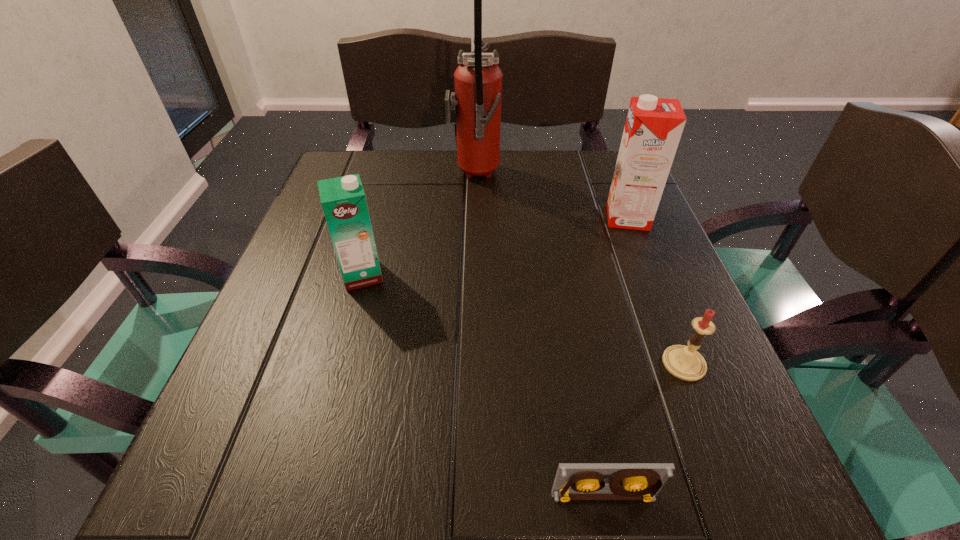
This screenshot has width=960, height=540. Find the location of `unoccupied area between the shortest object and the tallest object`. unoccupied area between the shortest object and the tallest object is located at coordinates (539, 336).

Find the location of `free space between the farthest object and the second tallest object`. free space between the farthest object and the second tallest object is located at coordinates (551, 197).

Where is `free spot between the third tallest object and the second farthest object`? The height and width of the screenshot is (540, 960). free spot between the third tallest object and the second farthest object is located at coordinates (494, 246).

Image resolution: width=960 pixels, height=540 pixels. Identify the location of empty space between the tallest object and the fourth shortest object. (551, 197).

This screenshot has height=540, width=960. What are the coordinates of `free point between the second tallest object and the third object from right to left` in the screenshot? It's located at (615, 357).

Image resolution: width=960 pixels, height=540 pixels. I want to click on empty space that is in between the fourth tallest object and the taller carton, so click(x=656, y=291).

The height and width of the screenshot is (540, 960). What are the coordinates of `object that is the closest one to the third object from right to left` in the screenshot? It's located at (684, 362).

Locate which object ranks second in proximity to the third object from right to left. Please provide its 2D coordinates. Your answer should be formatted as a tuple, i.e. [(x, y)], where the tuple contains the x and y coordinates of a point satisfying the conditions above.

[(343, 200)]

The image size is (960, 540). What are the coordinates of `free space that satisfies the following two spatial constraints: 1. on the back side of the fourth tallest object; 2. at the nozzle of the farthest object` in the screenshot? It's located at (610, 177).

Where is `vacant area in the image that satisfies the following two spatial constraints: 1. on the back side of the right carton; 2. on the right side of the candle`? vacant area in the image that satisfies the following two spatial constraints: 1. on the back side of the right carton; 2. on the right side of the candle is located at coordinates (626, 217).